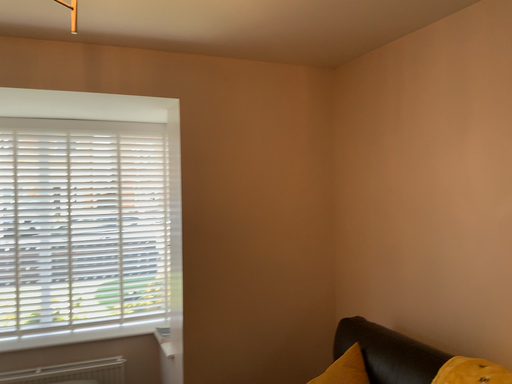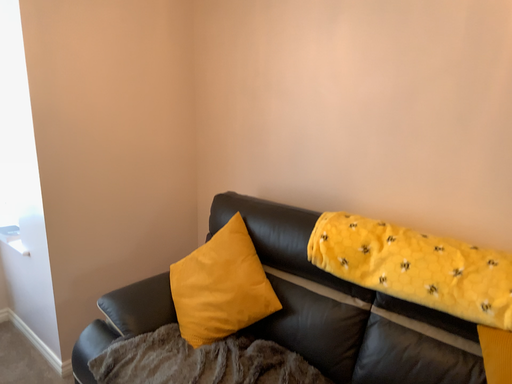
Question: Which way did the camera rotate in the video?

Choices:
 (A) rotated downward
 (B) rotated upward

Answer: (A)